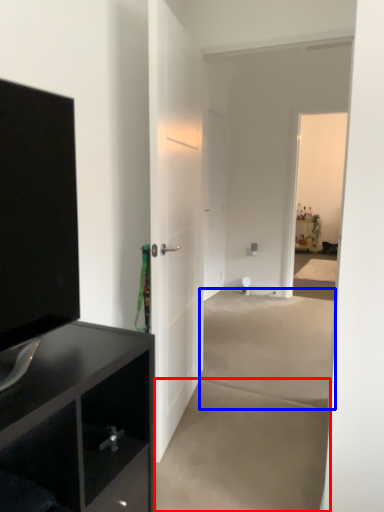
Question: Which point is closer to the camera, concrete (highlighted by a red box) or concrete (highlighted by a blue box)?

Choices:
 (A) concrete
 (B) concrete

Answer: (A)